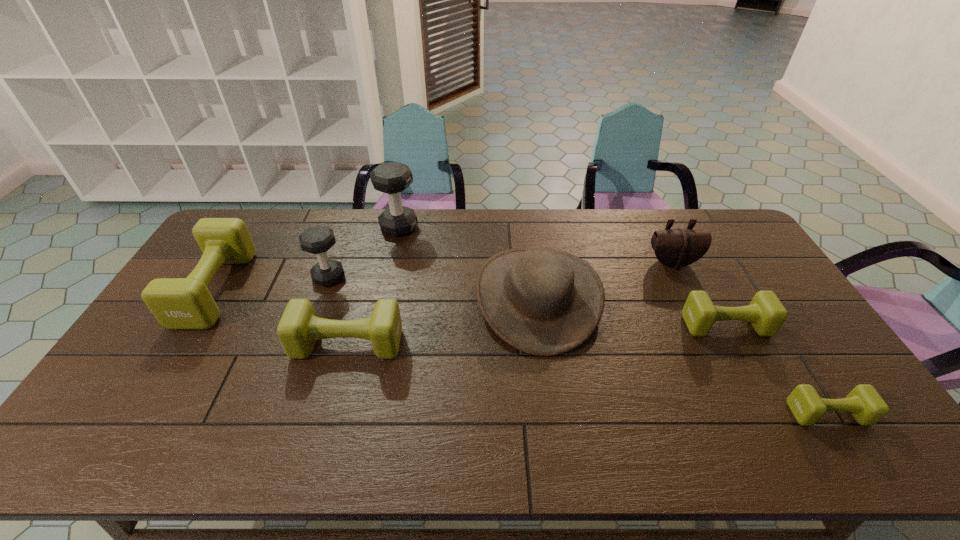
Find the location of a particular element. the right gray dumbbell is located at coordinates (392, 178).

Where is `the tallest dumbbell`? This screenshot has height=540, width=960. the tallest dumbbell is located at coordinates (392, 178).

In order to click on the smaller gray dumbbell in this screenshot , I will do `click(317, 240)`.

I want to click on the nearer gray dumbbell, so click(x=317, y=240).

Where is `brown pouch`? brown pouch is located at coordinates (680, 247).

At what (x,y) coordinates should I click in order to perform the action: click on the fourth shortest dumbbell. Please return your answer as a coordinate pair (x, y). Looking at the image, I should click on (177, 303).

You are a GUI agent. You are given a task and a screenshot of the screen. Output one action in this format:
    pyautogui.click(x=<x>, y=<y>)
    Task: Click on the biggest olive dumbbell
    The width and height of the screenshot is (960, 540).
    Given the screenshot: What is the action you would take?
    pyautogui.click(x=177, y=303)

Locate an element on the screen. cowboy hat is located at coordinates (542, 301).

Locate an element on the screen. brown cowboy hat is located at coordinates (542, 301).

Find the location of a particular element. Image resolution: width=960 pixels, height=540 pixels. the second olive dumbbell from left to right is located at coordinates (299, 328).